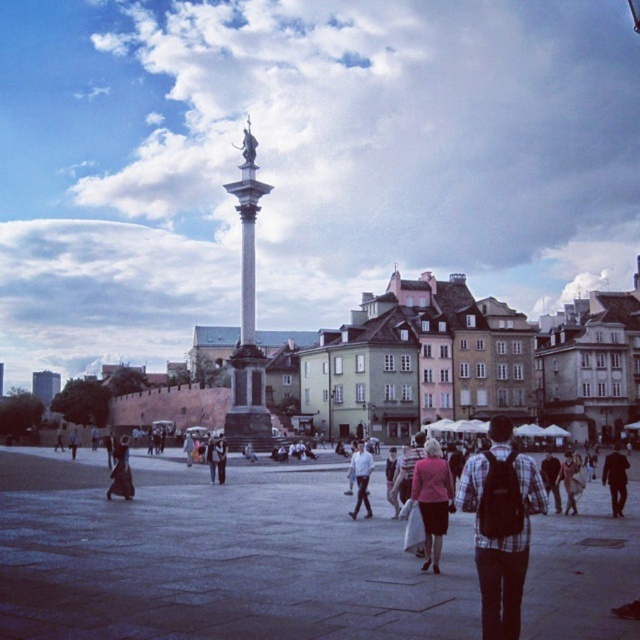
Can you confirm if plaid fabric shirt at center is taller than dark brown leather coat at lower left?

Yes.

Can you confirm if plaid fabric shirt at center is shorter than dark brown leather coat at lower left?

No, plaid fabric shirt at center is not shorter than dark brown leather coat at lower left.

What do you see at coordinates (500, 525) in the screenshot? I see `plaid fabric shirt at center` at bounding box center [500, 525].

Identify the location of plaid fabric shirt at center. (500, 525).

Is matte pink blazer at center taller than dark brown leather coat at lower left?

No, matte pink blazer at center is not taller than dark brown leather coat at lower left.

Is matte pink blazer at center above dark brown leather coat at lower left?

Indeed, matte pink blazer at center is positioned over dark brown leather coat at lower left.

Is point (436, 541) behind point (125, 476)?

No.

Locate an element on the screen. This screenshot has height=640, width=640. matte pink blazer at center is located at coordinates (433, 500).

Which is below, plaid fabric shirt at center or plaid shirt at center?

Positioned lower is plaid shirt at center.

Who is positioned more to the right, plaid fabric shirt at center or plaid shirt at center?

plaid shirt at center is more to the right.

You are a GUI agent. You are given a task and a screenshot of the screen. Output one action in this format:
    pyautogui.click(x=<x>, y=<y>)
    Task: Click on the plaid fabric shirt at center
    This screenshot has height=640, width=640.
    Given the screenshot: What is the action you would take?
    pyautogui.click(x=500, y=525)